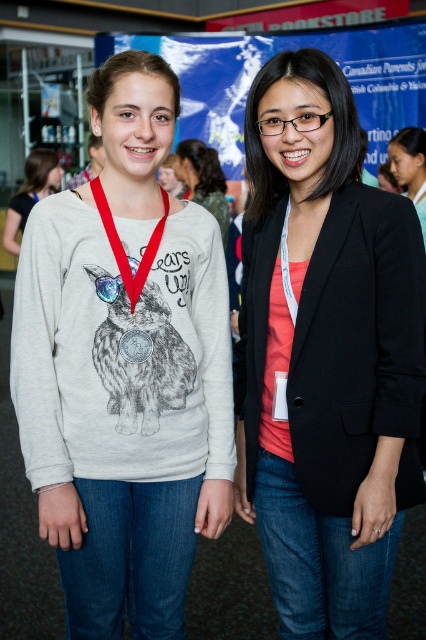
Can you confirm if matte silver medal at center is positioned to the left of matte white neck at center?

Indeed, matte silver medal at center is positioned on the left side of matte white neck at center.

Who is more forward, [129,168] or [307,157]?

Point [307,157] is more forward.

Does point (112, 177) come behind point (307, 157)?

Yes, point (112, 177) is behind point (307, 157).

Image resolution: width=426 pixels, height=640 pixels. Find the location of `matte silver medal at center`. matte silver medal at center is located at coordinates (131, 179).

Which is above, white matte sweatshirt at center or matte gray sweatshirt with rabbit print at center?

white matte sweatshirt at center

Is white matte sweatshirt at center smaller than matte gray sweatshirt with rabbit print at center?

No, white matte sweatshirt at center is not smaller than matte gray sweatshirt with rabbit print at center.

Is point (222, 188) behind point (28, 172)?

No, (222, 188) is closer to viewer.

I want to click on white matte sweatshirt at center, so click(x=203, y=179).

Which is below, white matte sweatshirt at center or red fabric lanyard at center?

red fabric lanyard at center is lower down.

Does white matte sweatshirt at center have a lesser width compared to red fabric lanyard at center?

No, white matte sweatshirt at center is not thinner than red fabric lanyard at center.

Which is behind, point (192, 173) or point (138, 266)?

Positioned behind is point (192, 173).

Where is `white matte sweatshirt at center`? Image resolution: width=426 pixels, height=640 pixels. white matte sweatshirt at center is located at coordinates (203, 179).